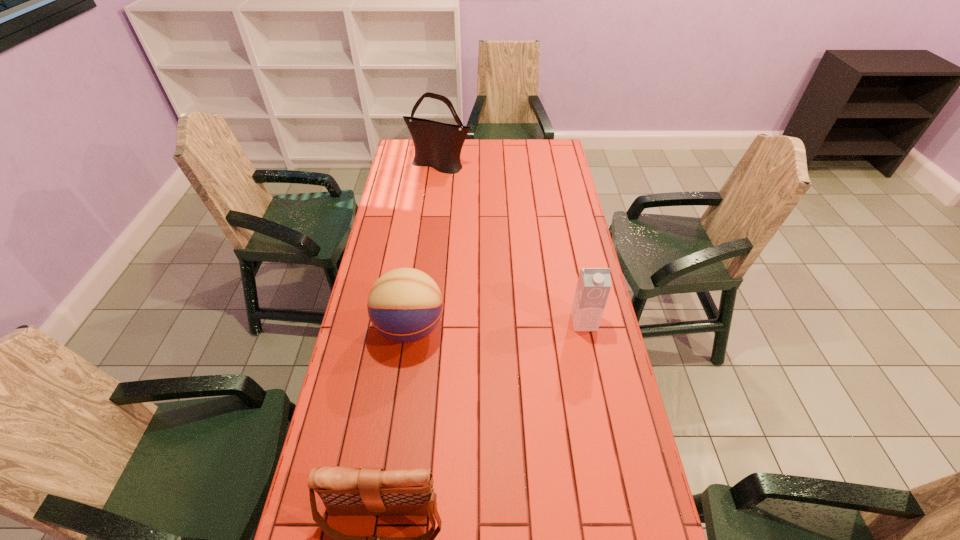
In order to click on vacant point located between the basketball and the farthest object in this screenshot , I will do `click(424, 247)`.

Select which object appears as the second closest to the shorter shoulder bag. Please provide its 2D coordinates. Your answer should be formatted as a tuple, i.e. [(x, y)], where the tuple contains the x and y coordinates of a point satisfying the conditions above.

[(594, 284)]

Identify which object is the third closest to the basketball. Please provide its 2D coordinates. Your answer should be formatted as a tuple, i.e. [(x, y)], where the tuple contains the x and y coordinates of a point satisfying the conditions above.

[(438, 145)]

The height and width of the screenshot is (540, 960). Identify the location of free space that satisfies the following two spatial constraints: 1. on the front label of the rightmost object; 2. on the patterned surface of the basketball. (585, 328).

Identify the location of free space that satisfies the following two spatial constraints: 1. on the front label of the rightmost object; 2. on the patterned surface of the basketball. This screenshot has height=540, width=960. (585, 328).